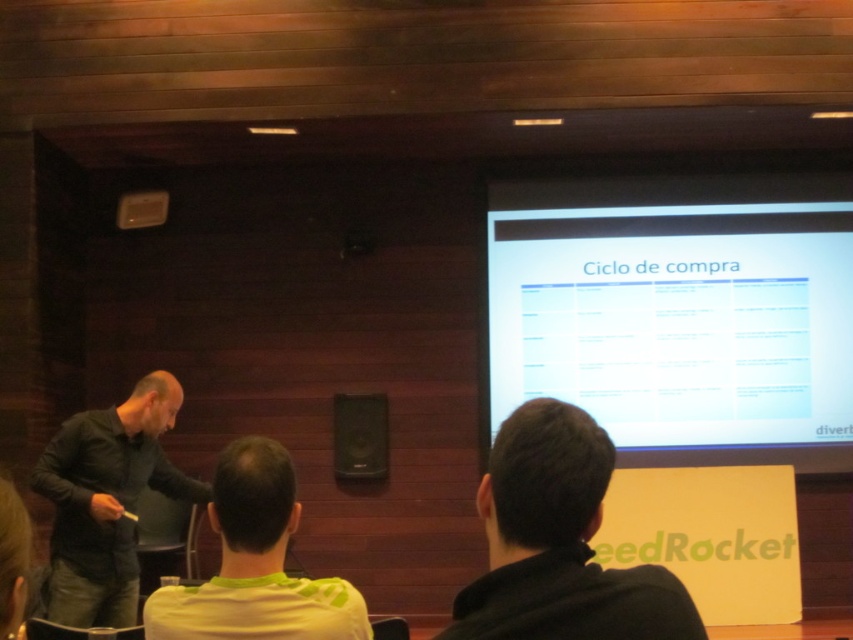
Question: In this image, where is white glossy projection screen at upper right located relative to black matte shirt at center?

Choices:
 (A) right
 (B) left

Answer: (A)

Question: Among these points, which one is nearest to the camera?

Choices:
 (A) (650, 605)
 (B) (90, 454)
 (C) (323, 600)
 (D) (349, 397)

Answer: (A)

Question: Does black matte shirt at center have a lesser width compared to black matte shirt at left?

Choices:
 (A) no
 (B) yes

Answer: (B)

Question: Estimate the real-world distances between objects in this image. Which object is farther from the black matte shirt at center?

Choices:
 (A) white glossy projection screen at upper right
 (B) black matte speaker at center

Answer: (A)

Question: Which of the following is the farthest from the observer?

Choices:
 (A) black matte speaker at center
 (B) white glossy projection screen at upper right

Answer: (A)

Question: Can you confirm if black matte shirt at center is bigger than black matte speaker at center?

Choices:
 (A) no
 (B) yes

Answer: (B)